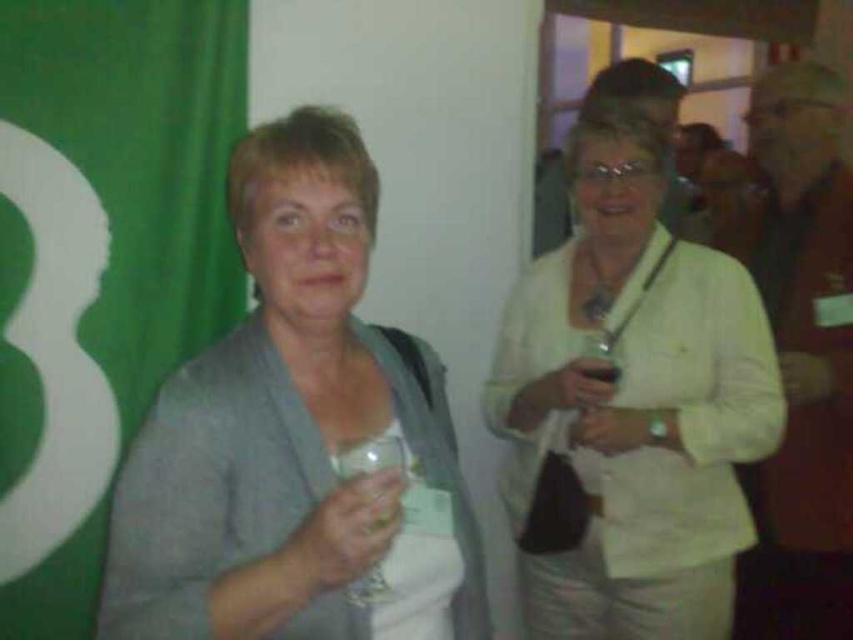
You are at a party and want to grab a drink. There is a gray fabric at center and a clear glass wine glass at center in your view. Which object is closer to the left side of the scene?

The gray fabric at center is closer to the left side of the scene because it is positioned to the left of the clear glass wine glass at center.

You are a photographer standing at point [607,104]. You want to take a photo of both women so that they are both in focus. The camera you are using has a depth of field that can cover 5 feet. Will you be able to capture both women in focus without adjusting your camera settings?

The two women are 5.69 feet apart, which exceeds the camera depth of field of 5 feet. Therefore, you will not be able to capture both women in focus without adjusting your camera settings.

You are at a party and want to place a napkin on the table between the gray fabric at center and the clear glass wine glass at center. Which object should you place the napkin closer to to ensure it doesn not spill?

The gray fabric at center might be wider than clear glass wine glass at center, so placing the napkin closer to the gray fabric at center would provide more stability and reduce the risk of spillage.